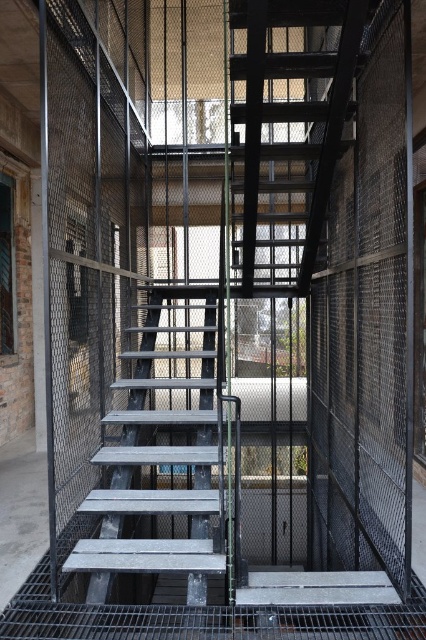
Question: Among these objects, which one is farthest from the camera?

Choices:
 (A) metallic gray stairs at center
 (B) matte black staircase at center

Answer: (A)

Question: Is matte black staircase at center further to the viewer compared to metallic gray stairs at center?

Choices:
 (A) no
 (B) yes

Answer: (A)

Question: Among these points, which one is farthest from the camera?

Choices:
 (A) (247, 163)
 (B) (137, 396)

Answer: (B)

Question: Can you confirm if matte black staircase at center is smaller than metallic gray stairs at center?

Choices:
 (A) no
 (B) yes

Answer: (A)

Question: Is matte black staircase at center thinner than metallic gray stairs at center?

Choices:
 (A) no
 (B) yes

Answer: (A)